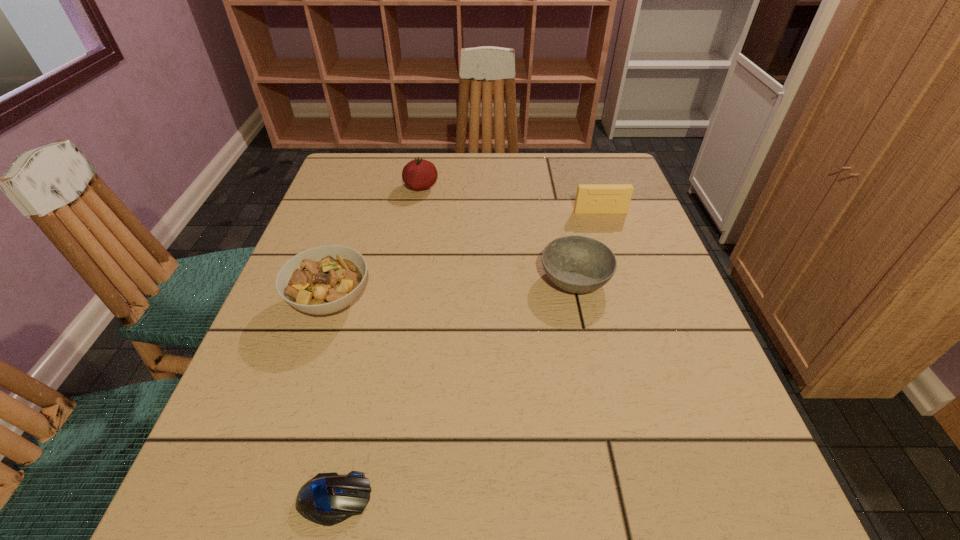
Find the location of a particular element. This screenshot has width=960, height=540. empty location between the stew and the fourth nearest object is located at coordinates (466, 256).

Identify which object is located as the nearest to the farthest object. Please provide its 2D coordinates. Your answer should be formatted as a tuple, i.e. [(x, y)], where the tuple contains the x and y coordinates of a point satisfying the conditions above.

[(325, 279)]

Identify which object is the second nearest to the second farthest object. Please provide its 2D coordinates. Your answer should be formatted as a tuple, i.e. [(x, y)], where the tuple contains the x and y coordinates of a point satisfying the conditions above.

[(419, 174)]

Locate an element on the screen. This screenshot has height=540, width=960. free space that satisfies the following two spatial constraints: 1. on the front side of the tomato; 2. on the left side of the second shortest object is located at coordinates (405, 279).

The width and height of the screenshot is (960, 540). Find the location of `free space that satisfies the following two spatial constraints: 1. at the front of the videotape with spools; 2. on the button side of the shortest object`. free space that satisfies the following two spatial constraints: 1. at the front of the videotape with spools; 2. on the button side of the shortest object is located at coordinates (696, 499).

Identify the location of free location that satisfies the following two spatial constraints: 1. on the front side of the second shortest object; 2. on the button side of the nearest object. The width and height of the screenshot is (960, 540). (624, 499).